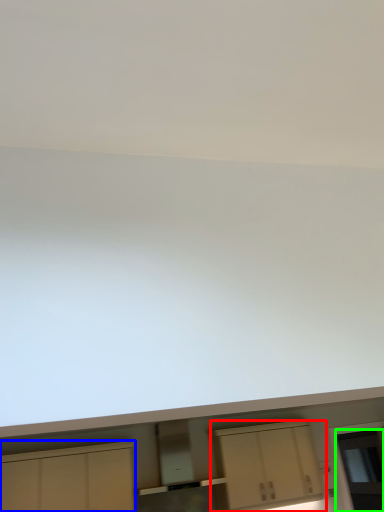
Question: Which is farther away from cabinetry (highlighted by a red box)? cabinetry (highlighted by a blue box) or glass door (highlighted by a green box)?

Choices:
 (A) cabinetry
 (B) glass door

Answer: (A)